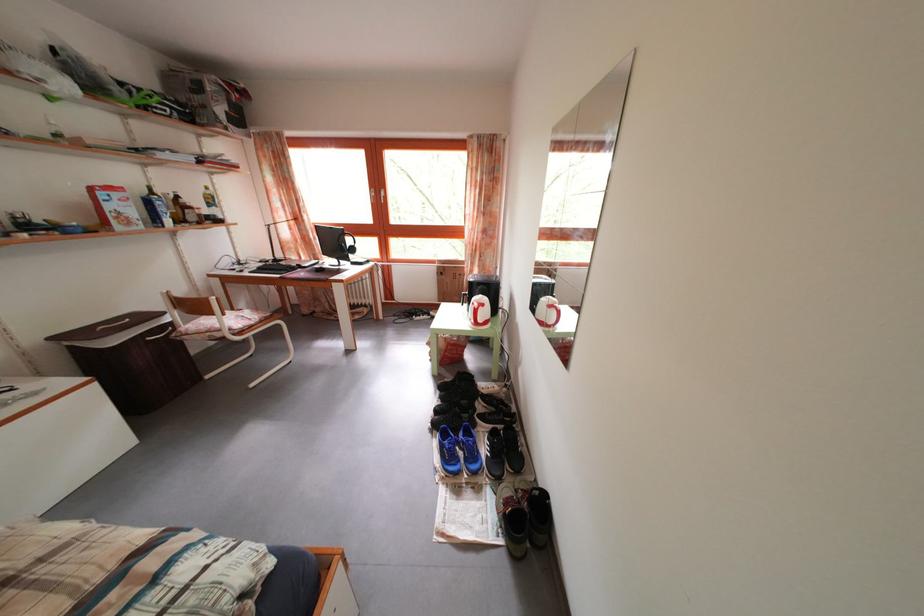
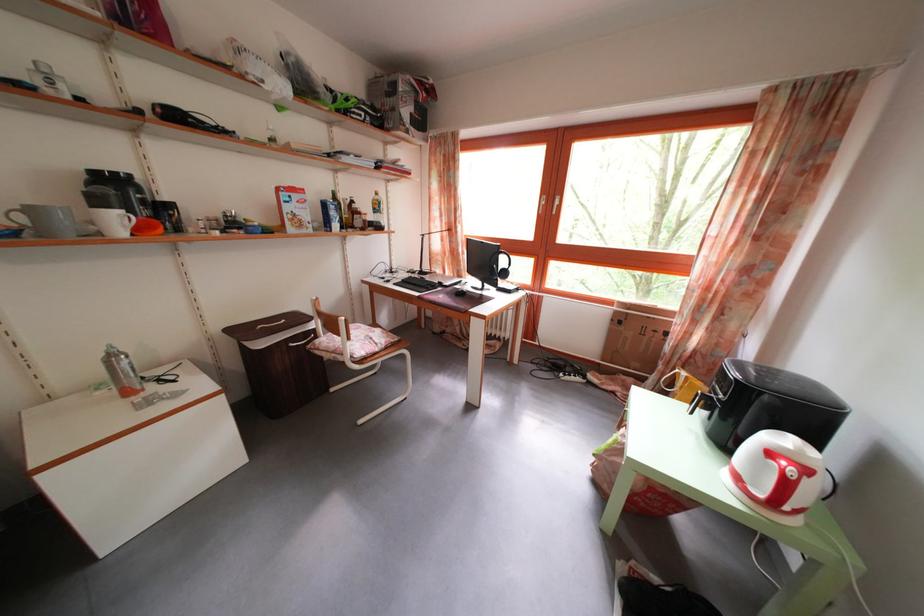
The point at (490,312) is marked in the first image. Where is the corresponding point in the second image?

(812, 477)